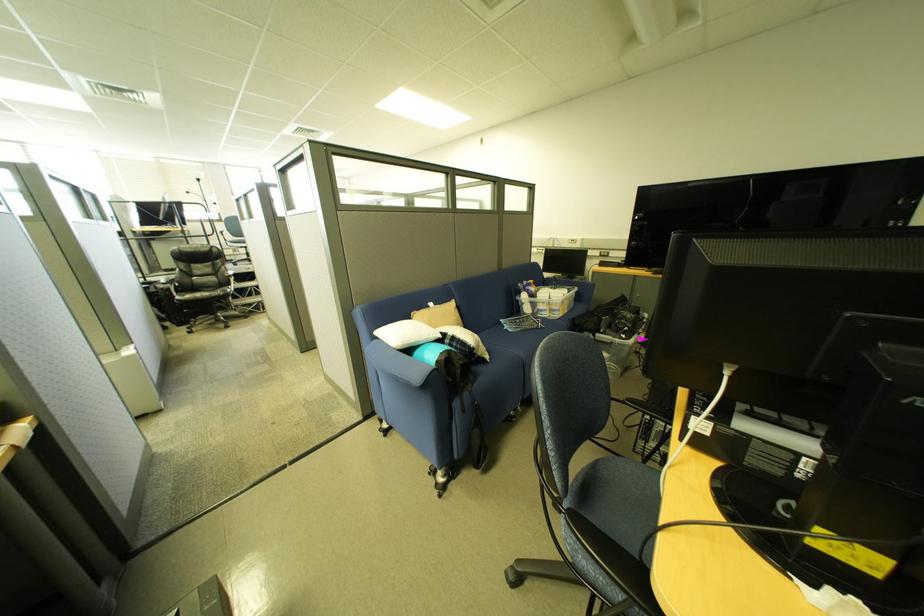
Find the location of a particular element. The height and width of the screenshot is (616, 924). blue round pillow is located at coordinates (429, 352).